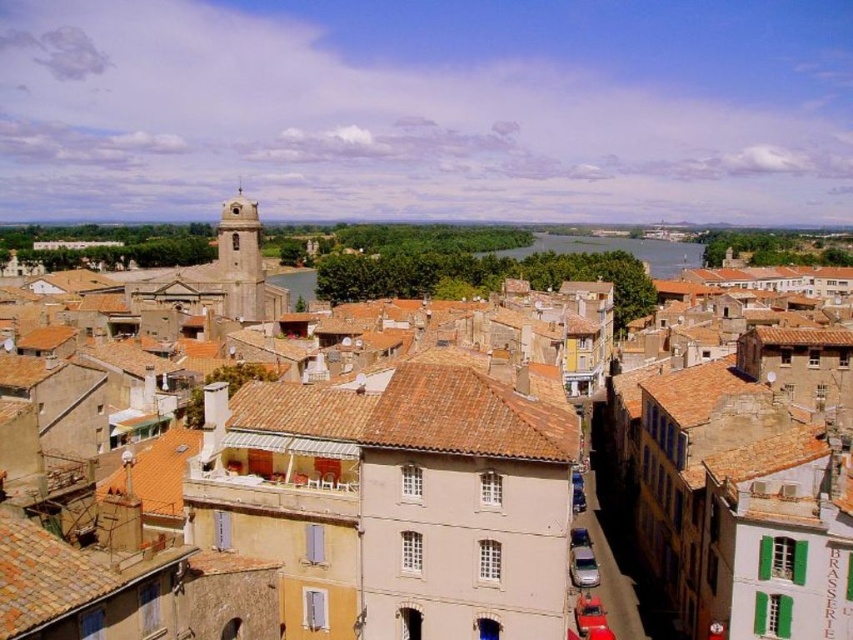
You are standing in the historic town and want to take a photo of the brown tile roof at center and the satin silver car at lower center. Which object should you focus on first to ensure both are in the frame without moving the camera?

You should focus on the brown tile roof at center first because it is closer to the viewer than the satin silver car at lower center, so adjusting the focus to the closer object will help keep both in the frame.

Consider the image. You are a delivery driver who needs to park your satin silver car at lower center. The brown tile roof at center is in the way. Can you park your car without moving the roof?

The brown tile roof at center is positioned over the satin silver car at lower center, meaning the car is already parked under the roof. Since the roof is a permanent structure, you cannot move it. Therefore, you can park your car there as it is already positioned under the brown tile roof at center.